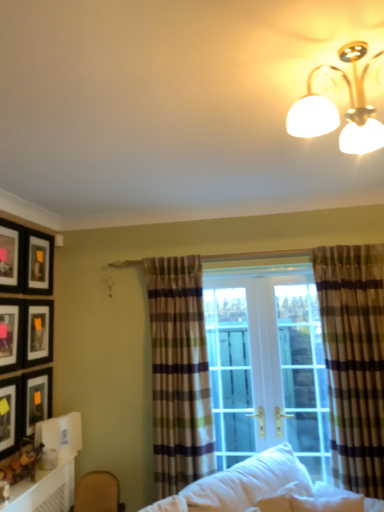
Question: Is gold metallic light fixture at upper right closer to the viewer compared to matte black picture frame at upper left, arranged as the 6th picture frame when ordered from the bottom?

Choices:
 (A) no
 (B) yes

Answer: (B)

Question: Is the surface of gold metallic light fixture at upper right in direct contact with matte black picture frame at upper left, which ranks as the 1th picture frame in top-to-bottom order?

Choices:
 (A) yes
 (B) no

Answer: (B)

Question: Is gold metallic light fixture at upper right bigger than matte black picture frame at upper left, arranged as the 6th picture frame when ordered from the bottom?

Choices:
 (A) no
 (B) yes

Answer: (B)

Question: Is gold metallic light fixture at upper right shorter than matte black picture frame at upper left, arranged as the 6th picture frame when ordered from the bottom?

Choices:
 (A) yes
 (B) no

Answer: (A)

Question: Is gold metallic light fixture at upper right at the right side of matte black picture frame at upper left, which ranks as the 1th picture frame in top-to-bottom order?

Choices:
 (A) no
 (B) yes

Answer: (B)

Question: Looking at their shapes, would you say gold metallic light fixture at upper right is wider or thinner than white soft studio couch at lower center?

Choices:
 (A) wide
 (B) thin

Answer: (B)

Question: Is point (345, 152) positioned closer to the camera than point (304, 501)?

Choices:
 (A) closer
 (B) farther

Answer: (A)

Question: Is gold metallic light fixture at upper right bigger or smaller than white soft studio couch at lower center?

Choices:
 (A) big
 (B) small

Answer: (B)

Question: From a real-world perspective, is gold metallic light fixture at upper right positioned above or below white soft studio couch at lower center?

Choices:
 (A) above
 (B) below

Answer: (A)

Question: From a real-world perspective, is matte black picture frame at left, which is the 4th picture frame in top-to-bottom order, positioned above or below gold metallic light fixture at upper right?

Choices:
 (A) above
 (B) below

Answer: (B)

Question: Is point (51, 352) closer or farther from the camera than point (345, 117)?

Choices:
 (A) closer
 (B) farther

Answer: (B)

Question: Is matte black picture frame at left, the 3th picture frame ordered from the bottom, inside the boundaries of gold metallic light fixture at upper right, or outside?

Choices:
 (A) inside
 (B) outside

Answer: (B)

Question: From the image's perspective, is matte black picture frame at left, the 3th picture frame ordered from the bottom, above or below gold metallic light fixture at upper right?

Choices:
 (A) above
 (B) below

Answer: (B)

Question: Considering their positions, is gold metallic light fixture at upper right located in front of or behind plaid fabric curtain at right, the second curtain from the left?

Choices:
 (A) front
 (B) behind

Answer: (A)

Question: Is gold metallic light fixture at upper right wider or thinner than plaid fabric curtain at right, the second curtain from the left?

Choices:
 (A) thin
 (B) wide

Answer: (B)